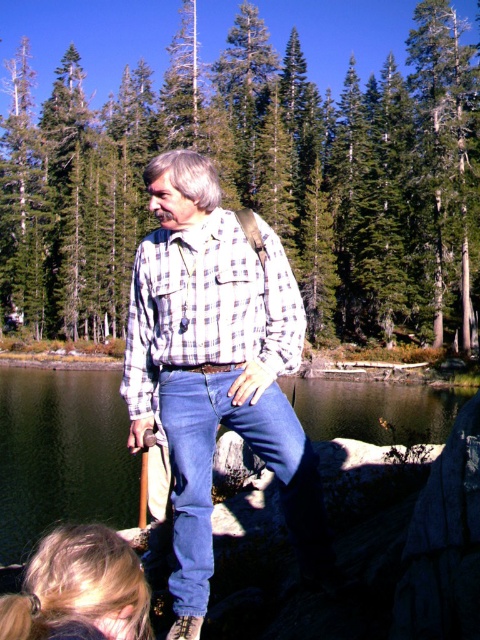
Between clear water at lower center and checkered fabric shirt at center, which one is positioned lower?

Positioned lower is clear water at lower center.

Is clear water at lower center closer to the viewer compared to checkered fabric shirt at center?

No, it is behind checkered fabric shirt at center.

Between point (56, 444) and point (181, 273), which one is positioned in front?

Point (181, 273) is more forward.

The height and width of the screenshot is (640, 480). Identify the location of clear water at lower center. (61, 454).

Does white checkered shirt at center appear under checkered fabric shirt at center?

Correct, white checkered shirt at center is located below checkered fabric shirt at center.

Between point (241, 276) and point (211, 227), which one is positioned behind?

The point (211, 227) is more distant.

The image size is (480, 640). Identify the location of white checkered shirt at center. (216, 365).

Who is taller, white checkered shirt at center or clear water at lower center?

Standing taller between the two is clear water at lower center.

In order to click on white checkered shirt at center in this screenshot , I will do `click(216, 365)`.

Find the location of a particular element. The width and height of the screenshot is (480, 640). white checkered shirt at center is located at coordinates (216, 365).